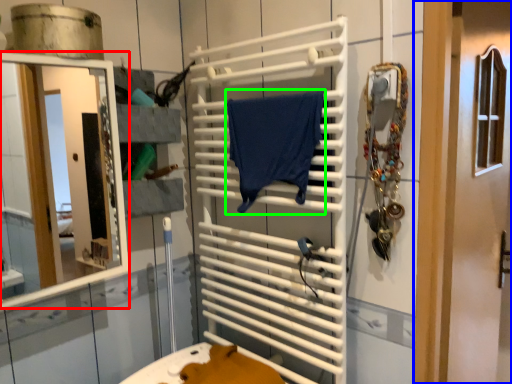
Question: Which is farther away from mirror (highlighted by a red box)? door (highlighted by a blue box) or bath towel (highlighted by a green box)?

Choices:
 (A) door
 (B) bath towel

Answer: (A)